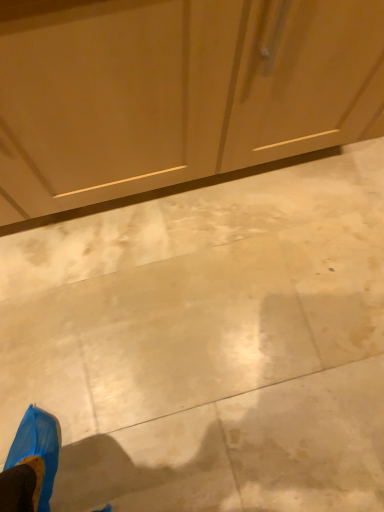
Question: From the image's perspective, is matte wood dresser at upper center on top of beige polished concrete at center?

Choices:
 (A) no
 (B) yes

Answer: (B)

Question: Does matte wood dresser at upper center appear on the right side of beige polished concrete at center?

Choices:
 (A) yes
 (B) no

Answer: (B)

Question: Is matte wood dresser at upper center oriented towards beige polished concrete at center?

Choices:
 (A) yes
 (B) no

Answer: (A)

Question: Considering the relative sizes of matte wood dresser at upper center and beige polished concrete at center in the image provided, is matte wood dresser at upper center thinner than beige polished concrete at center?

Choices:
 (A) no
 (B) yes

Answer: (B)

Question: Is matte wood dresser at upper center far away from beige polished concrete at center?

Choices:
 (A) no
 (B) yes

Answer: (A)

Question: Is matte wood dresser at upper center shorter than beige polished concrete at center?

Choices:
 (A) yes
 (B) no

Answer: (B)

Question: From a real-world perspective, is beige polished concrete at center physically above matte wood dresser at upper center?

Choices:
 (A) yes
 (B) no

Answer: (B)

Question: Is matte wood dresser at upper center located within beige polished concrete at center?

Choices:
 (A) yes
 (B) no

Answer: (B)

Question: Does beige polished concrete at center have a smaller size compared to matte wood dresser at upper center?

Choices:
 (A) no
 (B) yes

Answer: (B)

Question: Are beige polished concrete at center and matte wood dresser at upper center making contact?

Choices:
 (A) yes
 (B) no

Answer: (B)

Question: Is beige polished concrete at center positioned behind matte wood dresser at upper center?

Choices:
 (A) yes
 (B) no

Answer: (A)

Question: Is beige polished concrete at center positioned in front of matte wood dresser at upper center?

Choices:
 (A) no
 (B) yes

Answer: (A)

Question: Considering the positions of point (39, 244) and point (253, 160), is point (39, 244) closer or farther from the camera than point (253, 160)?

Choices:
 (A) farther
 (B) closer

Answer: (A)